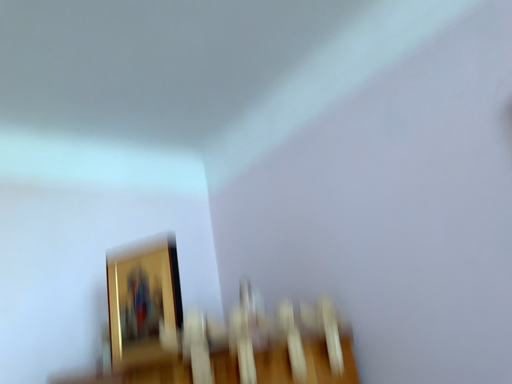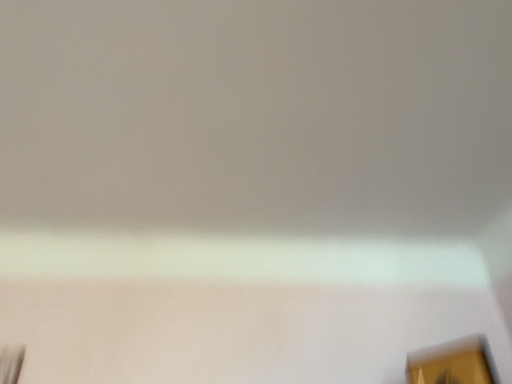
Question: Which way did the camera rotate in the video?

Choices:
 (A) rotated upward
 (B) rotated downward

Answer: (A)